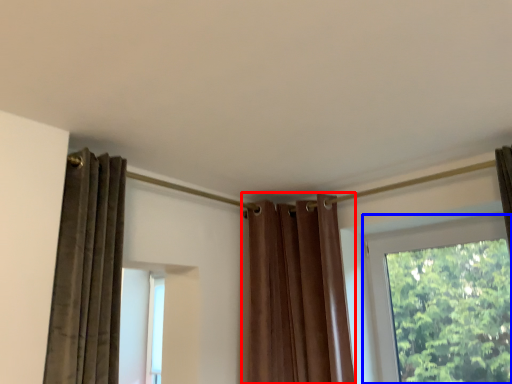
Question: Which point is closer to the camera, curtain (highlighted by a red box) or window (highlighted by a blue box)?

Choices:
 (A) curtain
 (B) window

Answer: (B)